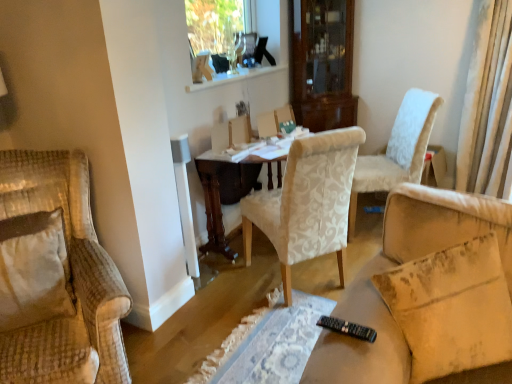
What is the approximate height of black plastic remote control at lower center?

The height of black plastic remote control at lower center is 1.43 inches.

This screenshot has width=512, height=384. Describe the element at coordinates (451, 308) in the screenshot. I see `beige fabric pillow at lower right` at that location.

Describe the element at coordinates (307, 202) in the screenshot. This screenshot has height=384, width=512. I see `white textured chair at center, the second chair from the left` at that location.

At what (x,y) coordinates should I click in order to perform the action: click on wooden table at center. Please return your answer as a coordinate pair (x, y). This screenshot has width=512, height=384. Looking at the image, I should click on (223, 193).

Where is `velvet beige armchair at left, which is the 3th chair in right-to-left order`? velvet beige armchair at left, which is the 3th chair in right-to-left order is located at coordinates (66, 278).

The height and width of the screenshot is (384, 512). I want to click on black plastic remote control at lower center, so click(x=347, y=328).

Can you confirm if white textured chair at center, the second chair from the left, is bigger than clear glass window frame at upper center?

Indeed, white textured chair at center, the second chair from the left, has a larger size compared to clear glass window frame at upper center.

Locate an element on the screen. window frame behind the white textured chair at center, the second chair when ordered from right to left is located at coordinates (232, 77).

From the image's perspective, which one is positioned lower, white textured chair at center, the second chair from the left, or clear glass window frame at upper center?

white textured chair at center, the second chair from the left, appears lower in the image.

In the scene shown: From a real-world perspective, which object stands above the other?

From a 3D spatial view, black plastic remote control at lower center is above.

Is white textured chair at center, the second chair when ordered from right to left, positioned with its back to black plastic remote control at lower center?

No, white textured chair at center, the second chair when ordered from right to left, is not facing away from black plastic remote control at lower center.

How many degrees apart are the facing directions of white textured chair at center, the second chair from the left, and black plastic remote control at lower center?

32.8 degrees separate the facing orientations of white textured chair at center, the second chair from the left, and black plastic remote control at lower center.

Would you consider white textured chair at center, the second chair when ordered from right to left, to be distant from black plastic remote control at lower center?

That's not correct — white textured chair at center, the second chair when ordered from right to left, is a little close to black plastic remote control at lower center.

Is black plastic remote control at lower center situated inside white textured chair at center, the second chair from the left, or outside?

black plastic remote control at lower center is outside white textured chair at center, the second chair from the left.

This screenshot has width=512, height=384. Identify the location of remote control below the white textured chair at center, the second chair from the left (from the image's perspective). (347, 328).

From the image's perspective, is black plastic remote control at lower center below white textured chair at center, the second chair when ordered from right to left?

Correct, black plastic remote control at lower center appears lower than white textured chair at center, the second chair when ordered from right to left, in the image.

Considering the sizes of objects black plastic remote control at lower center and white textured chair at center, the second chair when ordered from right to left, in the image provided, who is taller, black plastic remote control at lower center or white textured chair at center, the second chair when ordered from right to left,?

With more height is white textured chair at center, the second chair when ordered from right to left.

Is wooden table at center inside the boundaries of black plastic remote control at lower center, or outside?

wooden table at center lies outside black plastic remote control at lower center.

Which of these two, wooden table at center or black plastic remote control at lower center, is wider?

With larger width is wooden table at center.

Is point (227, 179) positioned before point (351, 336)?

No, (227, 179) is further to viewer.

From the image's perspective, would you say wooden table at center is shown under black plastic remote control at lower center?

No, from the image's perspective, wooden table at center is not below black plastic remote control at lower center.

Is clear glass window frame at upper center inside velvet beige armchair at left, acting as the first chair starting from the left?

No, velvet beige armchair at left, acting as the first chair starting from the left, does not contain clear glass window frame at upper center.

Can you tell me how much velvet beige armchair at left, which is the 3th chair in right-to-left order, and clear glass window frame at upper center differ in facing direction?

The facing directions of velvet beige armchair at left, which is the 3th chair in right-to-left order, and clear glass window frame at upper center are 34.3 degrees apart.

Is velvet beige armchair at left, acting as the first chair starting from the left, next to clear glass window frame at upper center?

velvet beige armchair at left, acting as the first chair starting from the left, is not next to clear glass window frame at upper center, and they're not touching.

Considering their positions, is velvet beige armchair at left, acting as the first chair starting from the left, located in front of or behind clear glass window frame at upper center?

Visually, velvet beige armchair at left, acting as the first chair starting from the left, is located in front of clear glass window frame at upper center.

Can we say wooden table at center lies outside clear glass window frame at upper center?

That's correct, wooden table at center is outside of clear glass window frame at upper center.

In terms of width, does wooden table at center look wider or thinner when compared to clear glass window frame at upper center?

Clearly, wooden table at center has more width compared to clear glass window frame at upper center.

Can you tell me how much wooden table at center and clear glass window frame at upper center differ in facing direction?

0.469 degrees.

Considering the positions of objects wooden table at center and clear glass window frame at upper center in the image provided, who is more to the left, wooden table at center or clear glass window frame at upper center?

clear glass window frame at upper center.

Which chair is the 2nd one when counting from the right side of the wooden table at center? Please provide its 2D coordinates.

[(397, 150)]

Is wooden table at center placed right next to white textured chair at center, positioned as the third chair in left-to-right order?

There is a gap between wooden table at center and white textured chair at center, positioned as the third chair in left-to-right order.

Does point (279, 173) come in front of point (379, 171)?

No, it is behind (379, 171).

From a real-world perspective, which is physically below, wooden table at center or white textured chair at center, marked as the first chair in a right-to-left arrangement?

wooden table at center is physically lower.

Locate an element on the screen. the 2nd chair in front of the clear glass window frame at upper center is located at coordinates (307, 202).

You are a GUI agent. You are given a task and a screenshot of the screen. Output one action in this format:
    pyautogui.click(x=<x>, y=<y>)
    Task: Click on the remote control above the white textured chair at center, the second chair when ordered from right to left (from a real-world perspective)
    This screenshot has height=384, width=512.
    Given the screenshot: What is the action you would take?
    pyautogui.click(x=347, y=328)

When comparing their distances from white textured chair at center, positioned as the third chair in left-to-right order, does wooden table at center or black plastic remote control at lower center seem closer?

wooden table at center.

When comparing their distances from white textured chair at center, the second chair from the left, does clear glass window frame at upper center or black plastic remote control at lower center seem further?

clear glass window frame at upper center is positioned further to the anchor white textured chair at center, the second chair from the left.

Looking at the image, which one is located further to black plastic remote control at lower center, white textured chair at center, the second chair from the left, or clear glass window frame at upper center?

The object further to black plastic remote control at lower center is clear glass window frame at upper center.

Looking at the image, which one is located further to wooden table at center, white textured chair at center, marked as the first chair in a right-to-left arrangement, or beige fabric pillow at lower right?

Based on the image, beige fabric pillow at lower right appears to be further to wooden table at center.

Which object lies further to the anchor point beige fabric pillow at lower right, velvet beige armchair at left, acting as the first chair starting from the left, or white textured chair at center, the second chair when ordered from right to left?

velvet beige armchair at left, acting as the first chair starting from the left, is positioned further to the anchor beige fabric pillow at lower right.

Looking at the image, which one is located closer to white textured chair at center, the second chair from the left, beige fabric pillow at lower right or velvet beige armchair at left, which is the 3th chair in right-to-left order?

beige fabric pillow at lower right lies closer to white textured chair at center, the second chair from the left, than the other object.

Considering their positions, is clear glass window frame at upper center positioned further to velvet beige armchair at left, acting as the first chair starting from the left, than black plastic remote control at lower center?

Based on the image, clear glass window frame at upper center appears to be further to velvet beige armchair at left, acting as the first chair starting from the left.

When comparing their distances from clear glass window frame at upper center, does white textured chair at center, the second chair when ordered from right to left, or white textured chair at center, positioned as the third chair in left-to-right order, seem further?

white textured chair at center, positioned as the third chair in left-to-right order, is further to clear glass window frame at upper center.

You are a GUI agent. You are given a task and a screenshot of the screen. Output one action in this format:
    pyautogui.click(x=<x>, y=<y>)
    Task: Click on the chair between clear glass window frame at upper center and white textured chair at center, the second chair when ordered from right to left, vertically
    
    Given the screenshot: What is the action you would take?
    pyautogui.click(x=397, y=150)

Identify the location of chair between wooden table at center and white textured chair at center, positioned as the third chair in left-to-right order, from left to right. Image resolution: width=512 pixels, height=384 pixels. (307, 202).

Where is `pillow situated between velvet beige armchair at left, which is the 3th chair in right-to-left order, and white textured chair at center, marked as the first chair in a right-to-left arrangement, from left to right`? This screenshot has height=384, width=512. pillow situated between velvet beige armchair at left, which is the 3th chair in right-to-left order, and white textured chair at center, marked as the first chair in a right-to-left arrangement, from left to right is located at coordinates (451, 308).

Find the location of a particular element. The height and width of the screenshot is (384, 512). table located between beige fabric pillow at lower right and white textured chair at center, marked as the first chair in a right-to-left arrangement, in the depth direction is located at coordinates (223, 193).